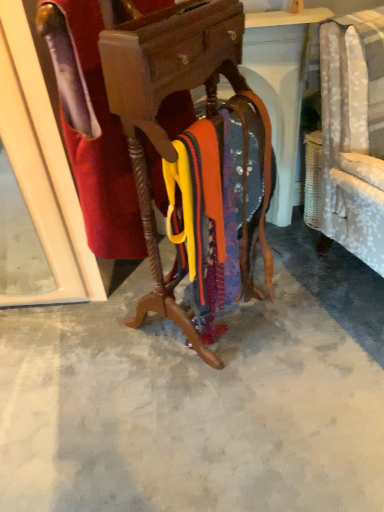
Question: Is velvet red robe at center outside of wooden coat rack at center?

Choices:
 (A) yes
 (B) no

Answer: (B)

Question: From a real-world perspective, is velvet red robe at center on wooden coat rack at center?

Choices:
 (A) yes
 (B) no

Answer: (A)

Question: Can you confirm if velvet red robe at center is positioned to the left of wooden coat rack at center?

Choices:
 (A) no
 (B) yes

Answer: (B)

Question: Can wooden coat rack at center be found inside velvet red robe at center?

Choices:
 (A) yes
 (B) no

Answer: (B)

Question: From the image's perspective, is velvet red robe at center above wooden coat rack at center?

Choices:
 (A) no
 (B) yes

Answer: (B)

Question: Is velvet red robe at center positioned before wooden coat rack at center?

Choices:
 (A) yes
 (B) no

Answer: (B)

Question: Does velvet red robe at center have a greater height compared to smooth concrete floor at center?

Choices:
 (A) yes
 (B) no

Answer: (A)

Question: Is velvet red robe at center positioned far away from smooth concrete floor at center?

Choices:
 (A) yes
 (B) no

Answer: (B)

Question: Considering the relative sizes of velvet red robe at center and smooth concrete floor at center in the image provided, is velvet red robe at center wider than smooth concrete floor at center?

Choices:
 (A) no
 (B) yes

Answer: (A)

Question: Is velvet red robe at center oriented away from smooth concrete floor at center?

Choices:
 (A) yes
 (B) no

Answer: (B)

Question: Is velvet red robe at center not within smooth concrete floor at center?

Choices:
 (A) yes
 (B) no

Answer: (A)

Question: From the image's perspective, would you say velvet red robe at center is positioned over smooth concrete floor at center?

Choices:
 (A) yes
 (B) no

Answer: (A)

Question: From the image's perspective, would you say wooden coat rack at center is positioned over velvet red robe at center?

Choices:
 (A) no
 (B) yes

Answer: (A)